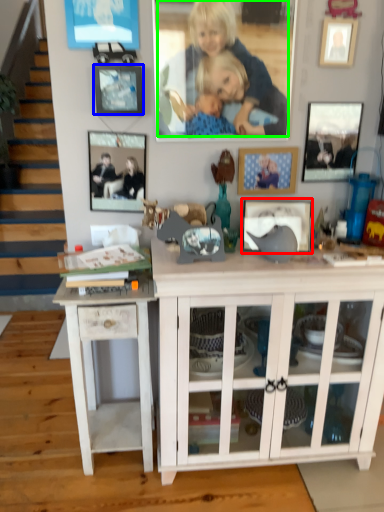
Question: Which object is the farthest from picture frame (highlighted by a red box)? Choose among these: picture frame (highlighted by a blue box) or person (highlighted by a green box).

Choices:
 (A) picture frame
 (B) person

Answer: (A)